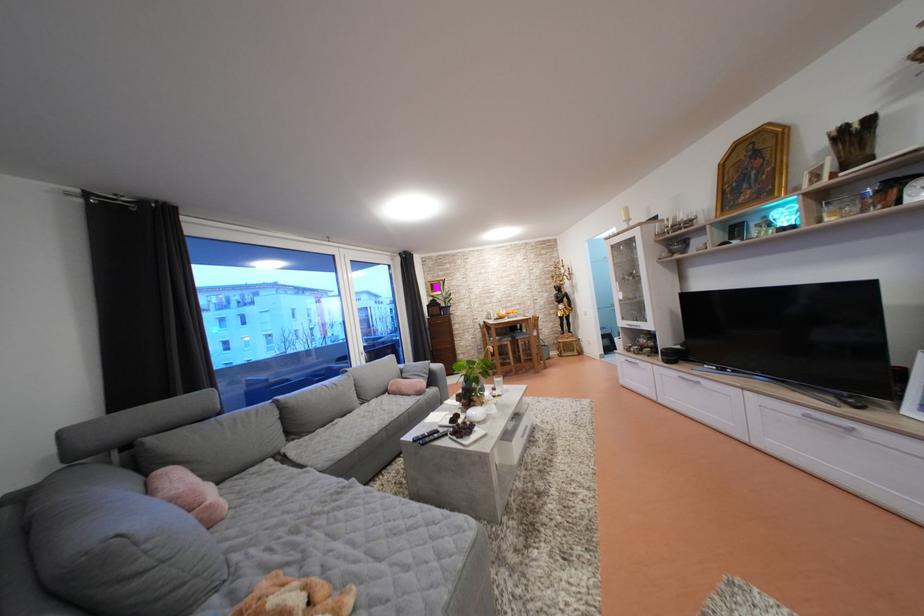
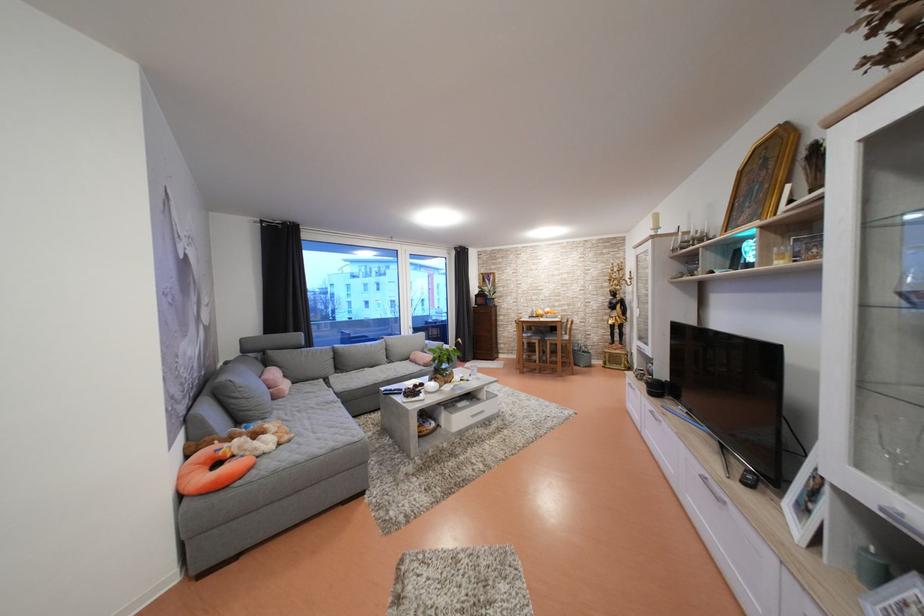
Locate, in the second image, the point that corresponds to point 225,488 in the first image.

(300, 387)